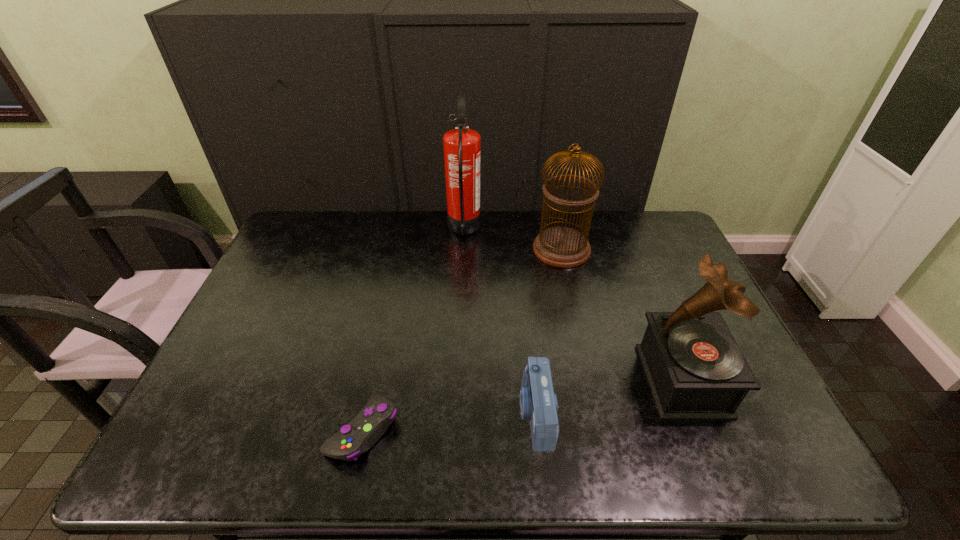
At what (x,y) coordinates should I click in order to perform the action: click on fire extinguisher. Please return your answer as a coordinate pair (x, y). This screenshot has width=960, height=540. Looking at the image, I should click on (461, 145).

Where is `the second object from right to left`? This screenshot has height=540, width=960. the second object from right to left is located at coordinates (565, 247).

Where is `the rightmost object`? the rightmost object is located at coordinates (695, 370).

The width and height of the screenshot is (960, 540). In order to click on camera in this screenshot , I will do `click(538, 403)`.

This screenshot has width=960, height=540. What are the coordinates of `the third object from left to right` in the screenshot? It's located at (538, 403).

Where is `the leftmost object`? This screenshot has height=540, width=960. the leftmost object is located at coordinates (357, 437).

I want to click on the shortest object, so click(x=357, y=437).

Locate an element on the screen. The height and width of the screenshot is (540, 960). vacant space located on the front-facing side of the fire extinguisher is located at coordinates (553, 229).

Locate an element on the screen. This screenshot has width=960, height=540. free space located 0.310m on the front-facing side of the fourth object from left to right is located at coordinates (443, 249).

Locate an element on the screen. free point located 0.370m on the front-facing side of the fourth object from left to right is located at coordinates (424, 249).